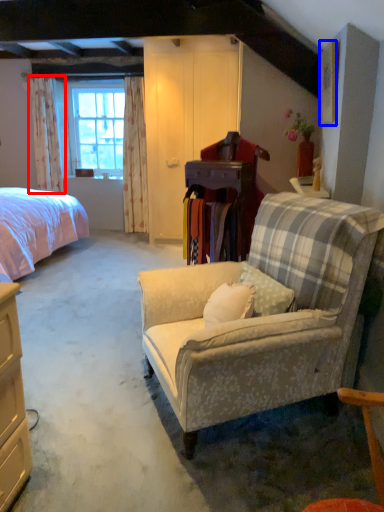
Question: Which object is closer to the camera taking this photo, curtain (highlighted by a red box) or picture frame (highlighted by a blue box)?

Choices:
 (A) curtain
 (B) picture frame

Answer: (B)